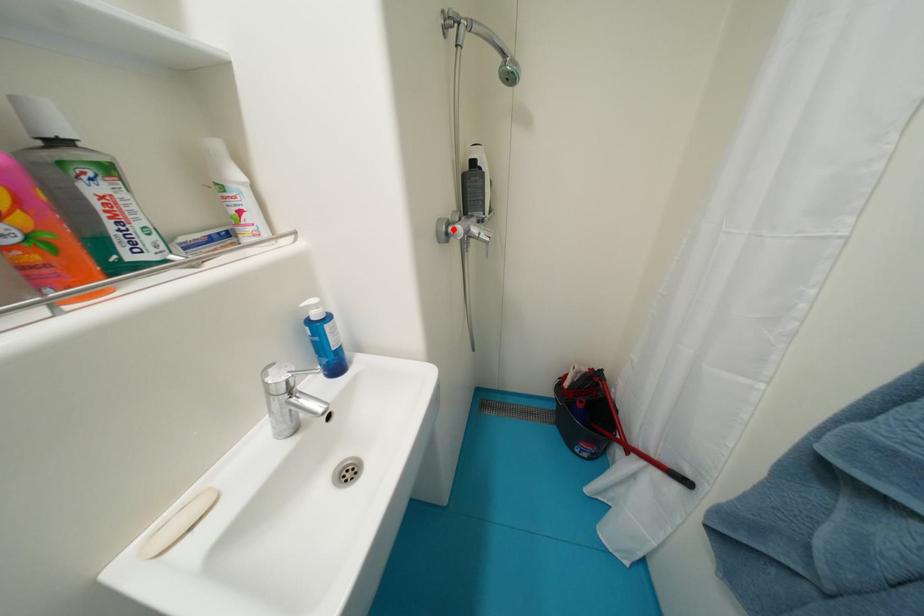
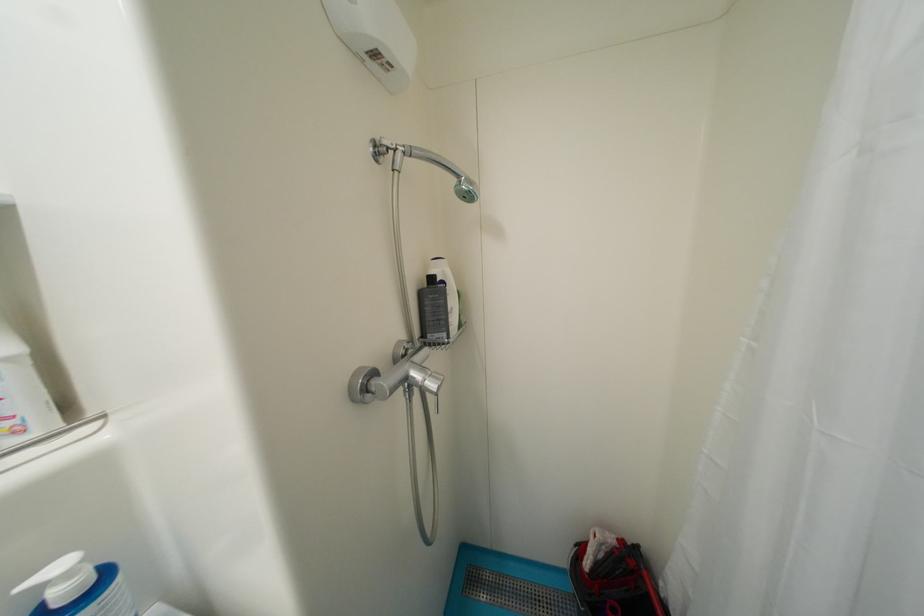
In the second image, find the point that corresponds to the highlighted location in the first image.

(374, 383)